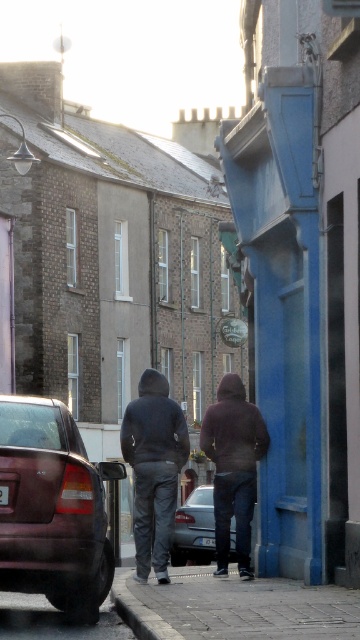
Question: Which point appears closest to the camera in this image?

Choices:
 (A) (246, 634)
 (B) (131, 618)
 (C) (237, 467)
 (D) (208, 486)

Answer: (A)

Question: Which of the following is the farthest from the observer?

Choices:
 (A) (138, 616)
 (B) (128, 625)

Answer: (B)

Question: Among these points, which one is nearest to the camera?

Choices:
 (A) [68, 570]
 (B) [290, 611]

Answer: (B)

Question: Is brick pavement at lower center bigger than dark gray hoodie at center?

Choices:
 (A) no
 (B) yes

Answer: (A)

Question: Does brick pavement at lower center appear under dark gray hoodie at center?

Choices:
 (A) yes
 (B) no

Answer: (A)

Question: Can you confirm if shiny dark red sedan at left is positioned below black plastic license plate at center?

Choices:
 (A) yes
 (B) no

Answer: (B)